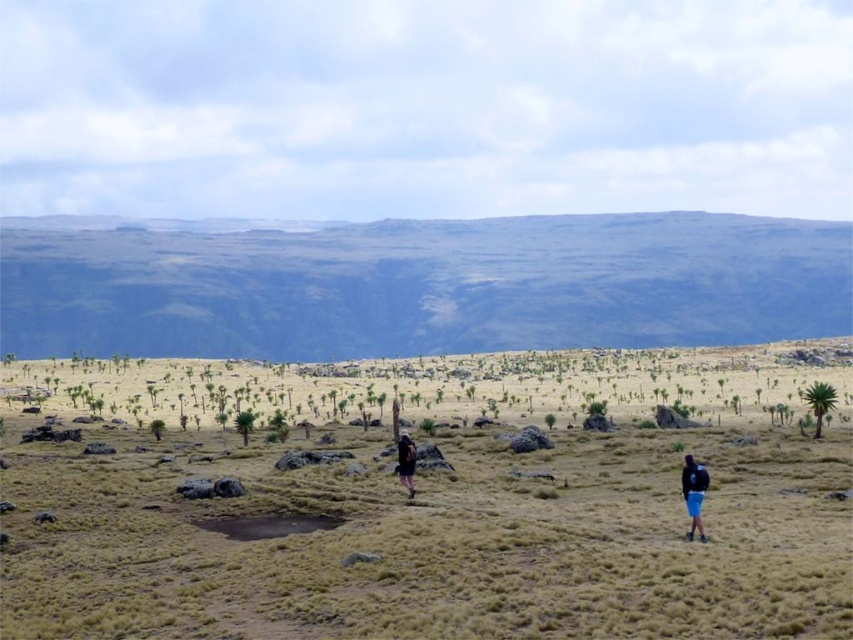
Between blue fabric backpack at lower right and black fabric backpack at center, which one has more height?

With more height is black fabric backpack at center.

Is blue fabric backpack at lower right positioned behind black fabric backpack at center?

That is False.

Is point (683, 468) closer to viewer compared to point (403, 445)?

Yes, it is in front of point (403, 445).

The height and width of the screenshot is (640, 853). Identify the location of blue fabric backpack at lower right. (693, 493).

Between point (148, 440) and point (697, 464), which one is positioned in front?

Point (697, 464) is in front.

The image size is (853, 640). Find the location of `dry grassland at center`. dry grassland at center is located at coordinates (427, 502).

Can you confirm if dry grassland at center is smaller than black fabric backpack at center?

Incorrect, dry grassland at center is not smaller in size than black fabric backpack at center.

Can you confirm if dry grassland at center is positioned below black fabric backpack at center?

Yes, dry grassland at center is below black fabric backpack at center.

Where is `dry grassland at center`? dry grassland at center is located at coordinates (427, 502).